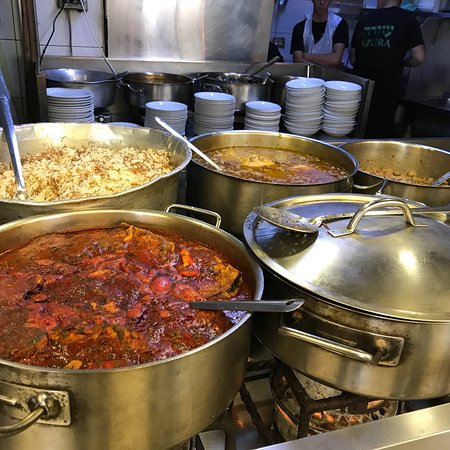
Where is `pot handle`? pot handle is located at coordinates (20, 424), (317, 341).